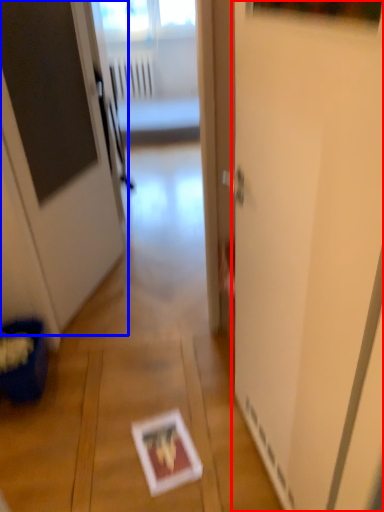
Question: Which object is further to the camera taking this photo, screen door (highlighted by a red box) or door (highlighted by a blue box)?

Choices:
 (A) screen door
 (B) door

Answer: (B)